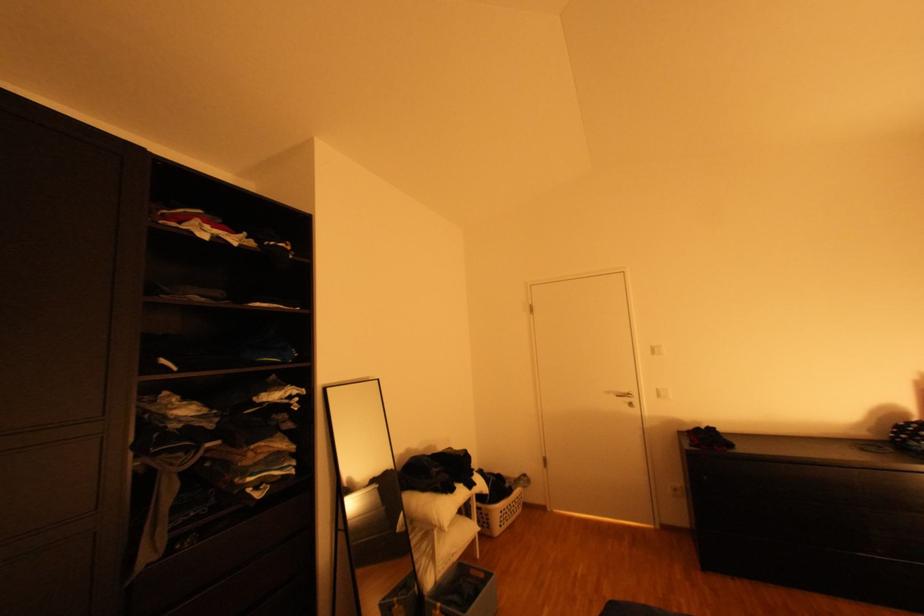
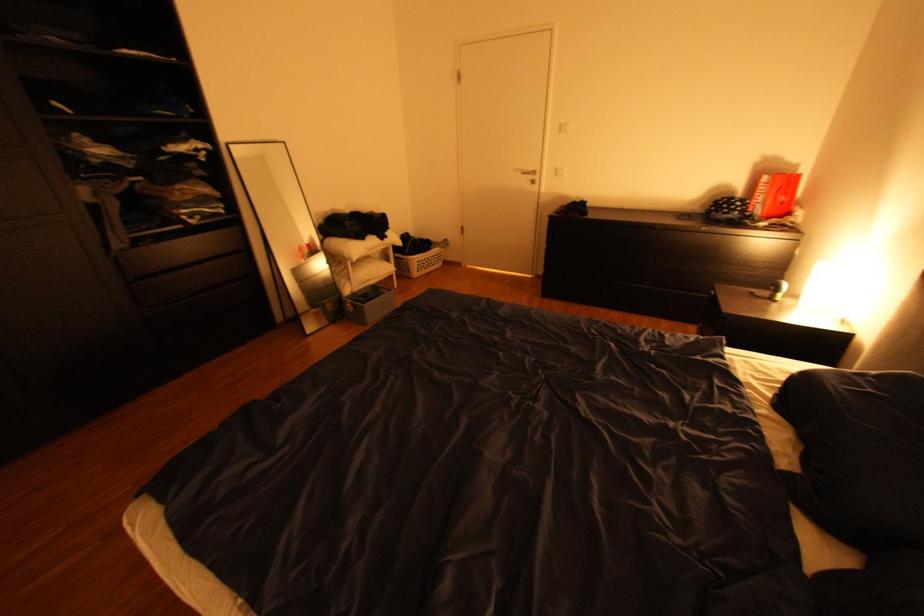
Find the pixel in the second image that matches pixel 669 395 in the first image.

(565, 174)